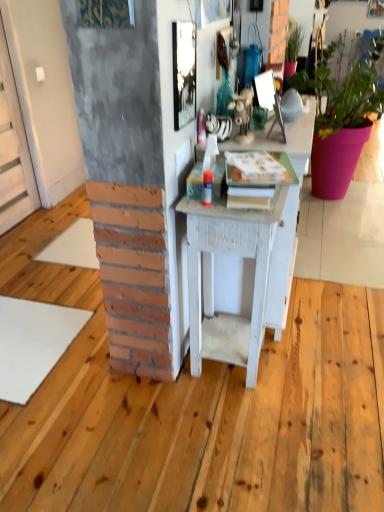
What do you see at coordinates (244, 262) in the screenshot? I see `white painted wood desk at center` at bounding box center [244, 262].

In order to click on white painted wood desk at center in this screenshot , I will do `click(244, 262)`.

What are the coordinates of `green matte plant at upper right, which appears as the 1th houseplant when viewed from the left` in the screenshot? It's located at (293, 50).

What is the approximate height of matte pink pot at right, positioned as the 2th houseplant in left-to-right order?

matte pink pot at right, positioned as the 2th houseplant in left-to-right order, is 4.14 feet tall.

Describe the element at coordinates (107, 13) in the screenshot. Image resolution: width=384 pixels, height=512 pixels. I see `metallic textured picture frame at upper center, positioned as the first picture frame in left-to-right order` at that location.

The image size is (384, 512). What are the coordinates of `white painted wood desk at center` in the screenshot? It's located at (244, 262).

Is metallic reflective mirror at upper center, which is the 2th picture frame in left-to-right order, positioned beyond the bounds of metallic textured picture frame at upper center, arranged as the 1th picture frame when viewed from the front?

Yes, metallic reflective mirror at upper center, which is the 2th picture frame in left-to-right order, is outside of metallic textured picture frame at upper center, arranged as the 1th picture frame when viewed from the front.

Considering the sizes of objects metallic reflective mirror at upper center, which is the 2th picture frame in left-to-right order, and metallic textured picture frame at upper center, the 2th picture frame positioned from the right, in the image provided, who is taller, metallic reflective mirror at upper center, which is the 2th picture frame in left-to-right order, or metallic textured picture frame at upper center, the 2th picture frame positioned from the right,?

metallic textured picture frame at upper center, the 2th picture frame positioned from the right.

Can you confirm if metallic reflective mirror at upper center, which is the first picture frame from right to left, is bigger than metallic textured picture frame at upper center, positioned as the first picture frame in left-to-right order?

No.

What are the coordinates of `picture frame on the left of metallic reflective mirror at upper center, marked as the second picture frame in a front-to-back arrangement` in the screenshot? It's located at (107, 13).

Choose the correct answer: Is white painted wood desk at center inside matte pink pot at right, placed as the first houseplant when sorted from right to left, or outside it?

white painted wood desk at center is located beyond the bounds of matte pink pot at right, placed as the first houseplant when sorted from right to left.

Relative to matte pink pot at right, placed as the first houseplant when sorted from right to left, is white painted wood desk at center in front or behind?

white painted wood desk at center is positioned closer to the viewer than matte pink pot at right, placed as the first houseplant when sorted from right to left.

From the picture: Between white painted wood desk at center and matte pink pot at right, positioned as the 2th houseplant in left-to-right order, which one has smaller width?

With smaller width is white painted wood desk at center.

Looking at this image, from the image's perspective, relative to matte pink pot at right, placed as the first houseplant when sorted from right to left, is white painted wood desk at center above or below?

white painted wood desk at center is situated lower than matte pink pot at right, placed as the first houseplant when sorted from right to left, in the image.

From a real-world perspective, count 2nd picture frames upward from the white painted wood desk at center and point to it. Please provide its 2D coordinates.

[(107, 13)]

Who is bigger, white painted wood desk at center or metallic textured picture frame at upper center, which is counted as the 2th picture frame, starting from the back?

With larger size is white painted wood desk at center.

Which is less distant, (263, 257) or (131, 14)?

Point (131, 14)

Which is more to the right, white painted wood desk at center or metallic textured picture frame at upper center, positioned as the first picture frame in left-to-right order?

Positioned to the right is white painted wood desk at center.

Is white painted wood desk at center completely or partially outside of green matte plant at upper right, which appears as the 1th houseplant when viewed from the left?

Yes, white painted wood desk at center is outside of green matte plant at upper right, which appears as the 1th houseplant when viewed from the left.

Consider the image. Between white painted wood desk at center and green matte plant at upper right, which appears as the 1th houseplant when viewed from the left, which one appears on the right side from the viewer's perspective?

green matte plant at upper right, which appears as the 1th houseplant when viewed from the left, is more to the right.

From a real-world perspective, who is located higher, white painted wood desk at center or green matte plant at upper right, which appears as the 1th houseplant when viewed from the left?

green matte plant at upper right, which appears as the 1th houseplant when viewed from the left, is physically above.

From a real-world perspective, which houseplant is the 1st one underneath the metallic reflective mirror at upper center, marked as the second picture frame in a front-to-back arrangement? Please provide its 2D coordinates.

[(293, 50)]

Is point (296, 45) positioned after point (175, 47)?

Yes, point (296, 45) is farther from viewer.

Between green matte plant at upper right, which appears as the 1th houseplant when viewed from the left, and metallic reflective mirror at upper center, marked as the second picture frame in a front-to-back arrangement, which one is positioned behind?

green matte plant at upper right, which appears as the 1th houseplant when viewed from the left, is more distant.

From the image's perspective, which one is positioned lower, green matte plant at upper right, the 2th houseplant positioned from the right, or metallic reflective mirror at upper center, positioned as the 1th picture frame in back-to-front order?

metallic reflective mirror at upper center, positioned as the 1th picture frame in back-to-front order, is shown below in the image.

In the image, is metallic reflective mirror at upper center, which is the first picture frame from right to left, positioned in front of or behind matte pink pot at right, positioned as the 2th houseplant in left-to-right order?

metallic reflective mirror at upper center, which is the first picture frame from right to left, is positioned closer to the viewer than matte pink pot at right, positioned as the 2th houseplant in left-to-right order.

From the image's perspective, would you say metallic reflective mirror at upper center, positioned as the 1th picture frame in back-to-front order, is shown under matte pink pot at right, positioned as the 2th houseplant in left-to-right order?

Yes, from the image's perspective, metallic reflective mirror at upper center, positioned as the 1th picture frame in back-to-front order, is beneath matte pink pot at right, positioned as the 2th houseplant in left-to-right order.

This screenshot has width=384, height=512. What are the coordinates of `the 1st picture frame to the left when counting from the matte pink pot at right, placed as the first houseplant when sorted from right to left` in the screenshot? It's located at (184, 72).

Which object is thinner, metallic reflective mirror at upper center, which is the 2th picture frame in left-to-right order, or matte pink pot at right, positioned as the 2th houseplant in left-to-right order?

metallic reflective mirror at upper center, which is the 2th picture frame in left-to-right order.

Who is smaller, green matte plant at upper right, the 2th houseplant positioned from the right, or white painted wood desk at center?

With smaller size is green matte plant at upper right, the 2th houseplant positioned from the right.

Considering the relative sizes of green matte plant at upper right, which appears as the 1th houseplant when viewed from the left, and white painted wood desk at center in the image provided, is green matte plant at upper right, which appears as the 1th houseplant when viewed from the left, taller than white painted wood desk at center?

In fact, green matte plant at upper right, which appears as the 1th houseplant when viewed from the left, may be shorter than white painted wood desk at center.

From a real-world perspective, which is physically above, green matte plant at upper right, the 2th houseplant positioned from the right, or white painted wood desk at center?

green matte plant at upper right, the 2th houseplant positioned from the right, from a real-world perspective.

Which object is further away from the camera, green matte plant at upper right, the 2th houseplant positioned from the right, or white painted wood desk at center?

green matte plant at upper right, the 2th houseplant positioned from the right, is further away from the camera.

Locate an element on the screen. This screenshot has height=512, width=384. picture frame on the left of metallic reflective mirror at upper center, which is the first picture frame from right to left is located at coordinates (107, 13).

Image resolution: width=384 pixels, height=512 pixels. I want to click on desk beneath the matte pink pot at right, placed as the first houseplant when sorted from right to left (from a real-world perspective), so click(x=244, y=262).

Considering their positions, is green matte plant at upper right, which appears as the 1th houseplant when viewed from the left, positioned further to metallic textured picture frame at upper center, the 2th picture frame positioned from the right, than matte pink pot at right, placed as the first houseplant when sorted from right to left?

The object further to metallic textured picture frame at upper center, the 2th picture frame positioned from the right, is matte pink pot at right, placed as the first houseplant when sorted from right to left.

Consider the image. Based on their spatial positions, is green matte plant at upper right, which appears as the 1th houseplant when viewed from the left, or matte pink pot at right, positioned as the 2th houseplant in left-to-right order, further from metallic reflective mirror at upper center, which is the 2th picture frame in left-to-right order?

matte pink pot at right, positioned as the 2th houseplant in left-to-right order, is further to metallic reflective mirror at upper center, which is the 2th picture frame in left-to-right order.

Which object lies further to the anchor point green matte plant at upper right, the 2th houseplant positioned from the right, white painted wood desk at center or matte pink pot at right, positioned as the 2th houseplant in left-to-right order?

white painted wood desk at center lies further to green matte plant at upper right, the 2th houseplant positioned from the right, than the other object.

Looking at this image, from the image, which object appears to be nearer to green matte plant at upper right, the 2th houseplant positioned from the right, metallic textured picture frame at upper center, which is counted as the 2th picture frame, starting from the back, or matte pink pot at right, placed as the first houseplant when sorted from right to left?

Based on the image, matte pink pot at right, placed as the first houseplant when sorted from right to left, appears to be nearer to green matte plant at upper right, the 2th houseplant positioned from the right.

Looking at the image, which one is located further to matte pink pot at right, positioned as the 2th houseplant in left-to-right order, green matte plant at upper right, which appears as the 1th houseplant when viewed from the left, or metallic reflective mirror at upper center, marked as the second picture frame in a front-to-back arrangement?

Among the two, metallic reflective mirror at upper center, marked as the second picture frame in a front-to-back arrangement, is located further to matte pink pot at right, positioned as the 2th houseplant in left-to-right order.

From the picture: Looking at the image, which one is located further to white painted wood desk at center, green matte plant at upper right, which appears as the 1th houseplant when viewed from the left, or metallic textured picture frame at upper center, positioned as the first picture frame in left-to-right order?

green matte plant at upper right, which appears as the 1th houseplant when viewed from the left, is further to white painted wood desk at center.

Based on their spatial positions, is white painted wood desk at center or matte pink pot at right, positioned as the 2th houseplant in left-to-right order, further from metallic reflective mirror at upper center, which is the 2th picture frame in left-to-right order?

matte pink pot at right, positioned as the 2th houseplant in left-to-right order, is positioned further to the anchor metallic reflective mirror at upper center, which is the 2th picture frame in left-to-right order.

From the image, which object appears to be nearer to matte pink pot at right, positioned as the 2th houseplant in left-to-right order, white painted wood desk at center or green matte plant at upper right, which appears as the 1th houseplant when viewed from the left?

Among the two, green matte plant at upper right, which appears as the 1th houseplant when viewed from the left, is located nearer to matte pink pot at right, positioned as the 2th houseplant in left-to-right order.

Locate an element on the screen. houseplant between metallic reflective mirror at upper center, which is the first picture frame from right to left, and green matte plant at upper right, the 2th houseplant positioned from the right, in the front-back direction is located at coordinates point(341,119).

The height and width of the screenshot is (512, 384). Identify the location of picture frame between metallic textured picture frame at upper center, arranged as the 1th picture frame when viewed from the front, and green matte plant at upper right, the 2th houseplant positioned from the right, from front to back. (184, 72).

Locate an element on the screen. The height and width of the screenshot is (512, 384). houseplant between white painted wood desk at center and green matte plant at upper right, which appears as the 1th houseplant when viewed from the left, along the z-axis is located at coordinates point(341,119).

This screenshot has width=384, height=512. In order to click on desk positioned between metallic textured picture frame at upper center, the 2th picture frame positioned from the right, and green matte plant at upper right, the 2th houseplant positioned from the right, from near to far in this screenshot , I will do `click(244, 262)`.